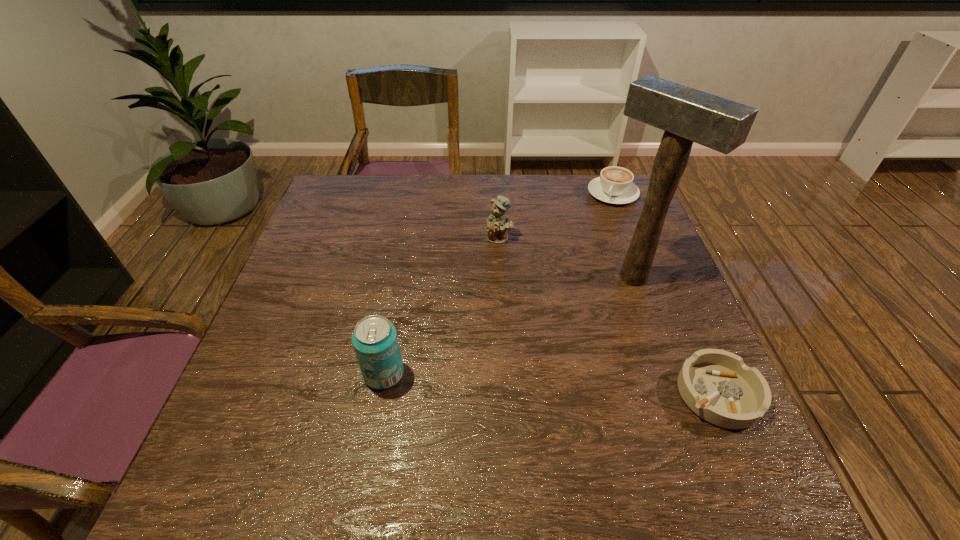
Locate an element on the screen. The height and width of the screenshot is (540, 960). free spot on the desktop that is between the leftmost object and the shortest object and is positioned on the striking surface of the third nearest object is located at coordinates (499, 381).

This screenshot has height=540, width=960. I want to click on free spot on the desktop that is between the leftmost object and the shortest object and is positioned on the front-facing side of the fourth nearest object, so click(505, 381).

Locate an element on the screen. This screenshot has width=960, height=540. vacant spot on the desktop that is between the leftmost object and the ashtray and is positioned on the side of the fourth tallest object with the handle is located at coordinates (511, 381).